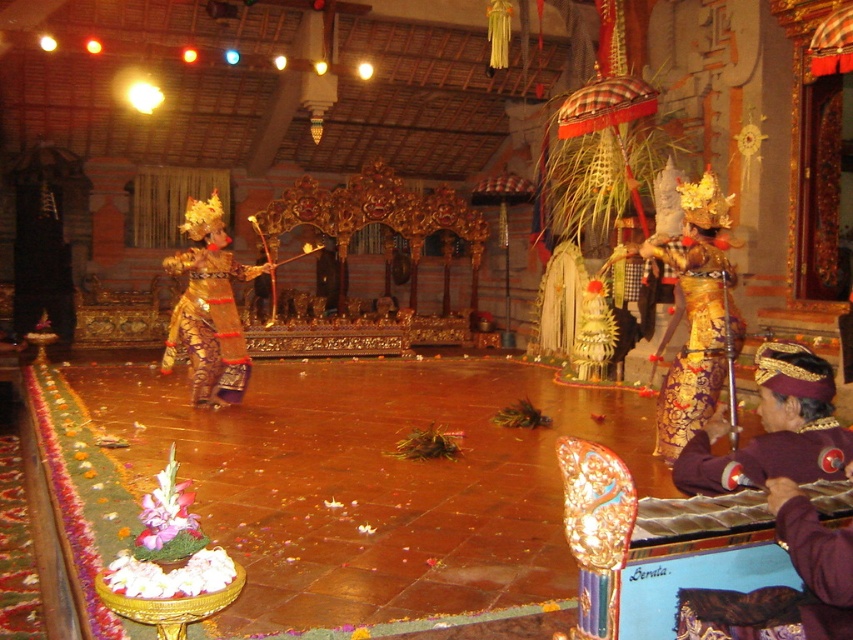
You are a photographer standing in the center of the room. You want to take a photo that includes both the point at coordinates point (759,468) and point (815,456). Which point should you focus on first to ensure both are in focus?

You should focus on point (759,468) first because it is closer to the camera than point (815,456). This ensures that both points will be in focus as the closer point determines the focal plane.

You are an attendee at this Balinese ceremony and want to take a photo of both the gold brocade costume at center and the purple velvet gloves at lower right. Since you can only focus on one object at a time, which one should you aim your camera at first to capture them both in the frame?

To capture both the gold brocade costume at center and the purple velvet gloves at lower right in the frame, you should aim your camera at the gold brocade costume at center first since it is positioned to the right of the purple velvet gloves at lower right, meaning it is closer to the right side of the scene. By focusing on the gold brocade costume at center, you can adjust the camera angle to include the purple velvet gloves at lower right in the left portion of the frame.

From the picture: You are a guest at a Balinese ceremony and want to take a photo of the performers. You notice two points marked in the scene. From your position at the entrance, which point is closer to you, point (688, 284) or point (753, 442)?

Point (753, 442) is closer to you because point (688, 284) is behind it.